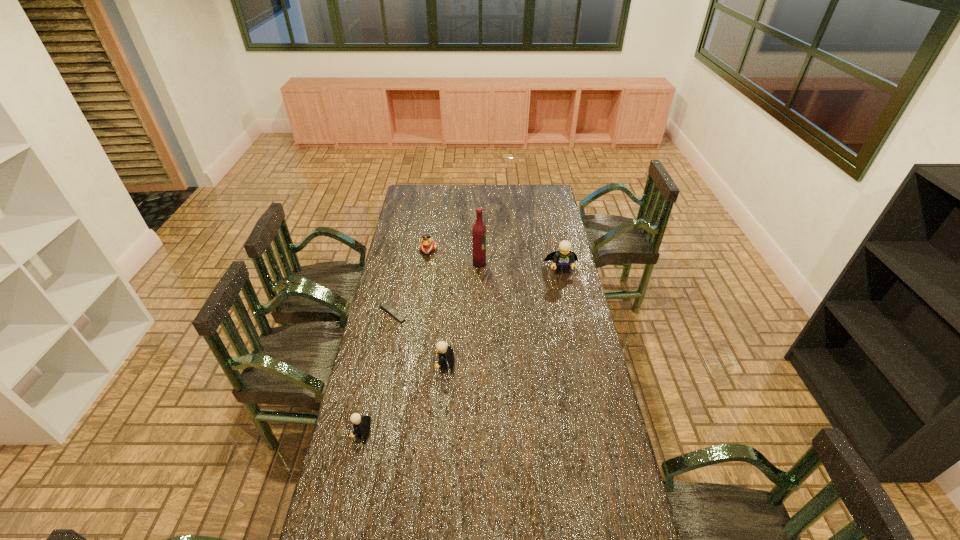
Where is `the closest Lego to the second Lego from right to left`? the closest Lego to the second Lego from right to left is located at coordinates (361, 425).

The height and width of the screenshot is (540, 960). I want to click on free location that satisfies the following two spatial constraints: 1. on the front-facing side of the rightmost Lego; 2. on the front-facing side of the shortest Lego, so click(x=596, y=432).

Identify the location of vacant area in the image that satisfies the following two spatial constraints: 1. on the front-facing side of the tallest Lego; 2. on the front-facing side of the second Lego from right to left. The width and height of the screenshot is (960, 540). click(x=582, y=364).